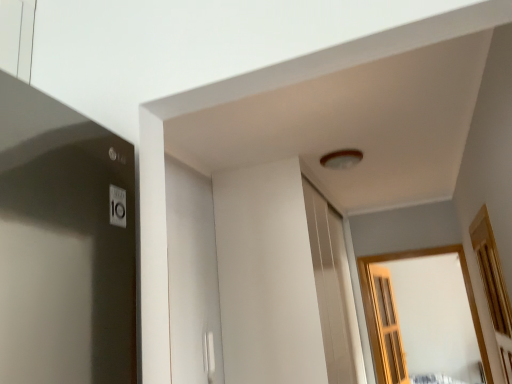
Question: Is wooden at right, the second window from the back, far from wooden screen door at right?

Choices:
 (A) yes
 (B) no

Answer: (A)

Question: Is wooden at right, placed as the first window when sorted from front to back, directly adjacent to wooden screen door at right?

Choices:
 (A) yes
 (B) no

Answer: (B)

Question: Is wooden at right, placed as the first window when sorted from front to back, at the right side of wooden screen door at right?

Choices:
 (A) no
 (B) yes

Answer: (B)

Question: Does wooden at right, the second window from the back, have a lesser height compared to wooden screen door at right?

Choices:
 (A) no
 (B) yes

Answer: (B)

Question: Can you confirm if wooden at right, placed as the first window when sorted from front to back, is smaller than wooden screen door at right?

Choices:
 (A) no
 (B) yes

Answer: (B)

Question: Can you confirm if wooden at right, placed as the first window when sorted from front to back, is positioned to the left of wooden screen door at right?

Choices:
 (A) yes
 (B) no

Answer: (B)

Question: From the image's perspective, does wooden-framed window at center, which is the 1th window in back-to-front order, appear lower than wooden screen door at right?

Choices:
 (A) no
 (B) yes

Answer: (A)

Question: From the image's perspective, does wooden-framed window at center, the 2th window positioned from the front, appear higher than wooden screen door at right?

Choices:
 (A) yes
 (B) no

Answer: (A)

Question: Is wooden-framed window at center, which is the 1th window in back-to-front order, facing towards wooden screen door at right?

Choices:
 (A) no
 (B) yes

Answer: (A)

Question: Does wooden-framed window at center, which is the 1th window in back-to-front order, have a greater width compared to wooden screen door at right?

Choices:
 (A) yes
 (B) no

Answer: (A)

Question: Is wooden-framed window at center, the 2th window positioned from the front, thinner than wooden screen door at right?

Choices:
 (A) yes
 (B) no

Answer: (B)

Question: Is wooden-framed window at center, which is the 1th window in back-to-front order, positioned behind wooden screen door at right?

Choices:
 (A) yes
 (B) no

Answer: (B)

Question: Can you confirm if wooden-framed window at center, which is the 1th window in back-to-front order, is smaller than wooden at right, placed as the first window when sorted from front to back?

Choices:
 (A) no
 (B) yes

Answer: (A)